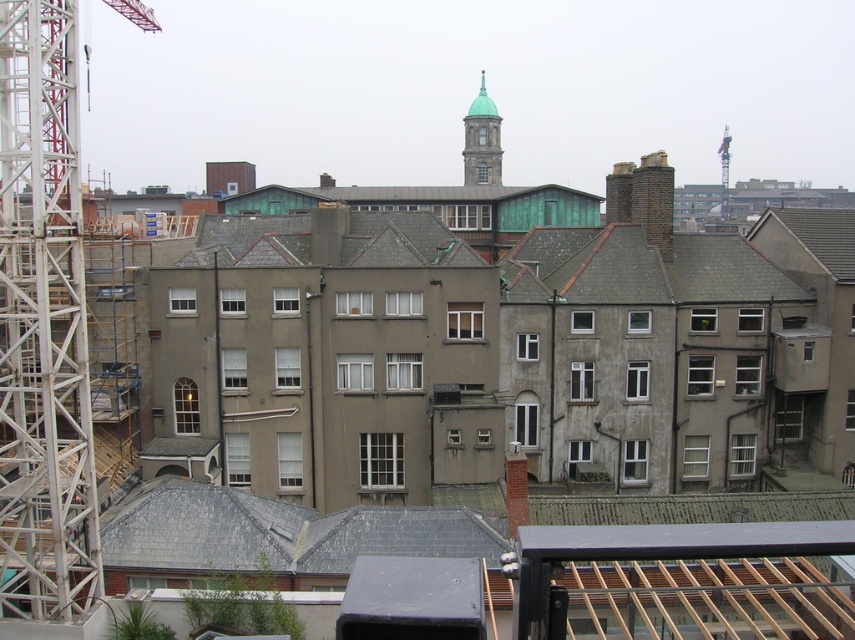
You are standing at the center of the image. Which direction should you look to see the white metal crane at left?

Answer: You should look to the left to see the white metal crane at left, as it is positioned at the left side of the image.

You are standing in the middle of the street looking at the white metal crane at left and the green copper bell tower at upper center. Which structure appears nearer to you?

The white metal crane at left appears nearer to you because it is closer to the viewer than the green copper bell tower at upper center.